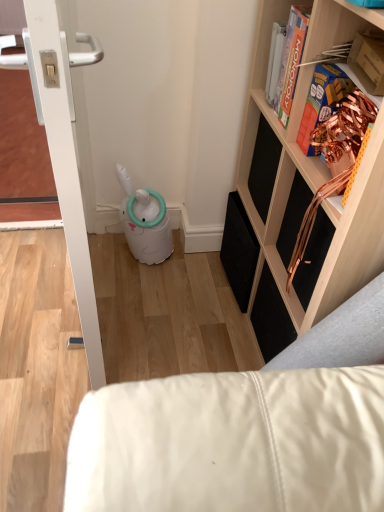
The image size is (384, 512). I want to click on white leather couch at lower right, so click(x=245, y=430).

Image resolution: width=384 pixels, height=512 pixels. What do you see at coordinates (322, 101) in the screenshot?
I see `copper foil book at upper right, arranged as the first book when ordered from the bottom` at bounding box center [322, 101].

Measure the distance between point (79,316) and camera.

1.14 meters.

Measure the distance between orange matte monopoly board game at upper right, which is the first book from top to bottom, and camera.

orange matte monopoly board game at upper right, which is the first book from top to bottom, is 35.55 inches from camera.

Locate an element on the screen. white leather couch at lower right is located at coordinates (245, 430).

From a real-world perspective, is orange matte monopoly board game at upper right, which appears as the 1th book when viewed from the back, positioned over copper foil book at upper right, the second book from the back, based on gravity?

Indeed, from a real-world perspective, orange matte monopoly board game at upper right, which appears as the 1th book when viewed from the back, stands above copper foil book at upper right, the second book from the back.

From the picture: From the image's perspective, is orange matte monopoly board game at upper right, which appears as the 1th book when viewed from the back, located above or below copper foil book at upper right, the second book from the back?

From the image's perspective, orange matte monopoly board game at upper right, which appears as the 1th book when viewed from the back, appears above copper foil book at upper right, the second book from the back.

Does orange matte monopoly board game at upper right, which is the second book from bottom to top, turn towards copper foil book at upper right, the second book from the back?

No, orange matte monopoly board game at upper right, which is the second book from bottom to top, is not aimed at copper foil book at upper right, the second book from the back.

Which of these two, orange matte monopoly board game at upper right, placed as the 2th book when sorted from front to back, or copper foil book at upper right, which is the 2th book in top-to-bottom order, is bigger?

With larger size is copper foil book at upper right, which is the 2th book in top-to-bottom order.

Is orange matte monopoly board game at upper right, which is the second book from bottom to top, situated inside wooden/black speaker at upper right or outside?

orange matte monopoly board game at upper right, which is the second book from bottom to top, is spatially positioned inside wooden/black speaker at upper right.

Where is `book that is the 2nd object to the left of the wooden/black speaker at upper right, starting at the anchor`? The width and height of the screenshot is (384, 512). book that is the 2nd object to the left of the wooden/black speaker at upper right, starting at the anchor is located at coordinates (291, 61).

Does point (294, 78) come behind point (258, 282)?

No, it is not.

Can you tell me how much wooden/black speaker at upper right and white glossy door at left differ in facing direction?

The angular difference between wooden/black speaker at upper right and white glossy door at left is 8.14 degrees.

Between wooden/black speaker at upper right and white glossy door at left, which one has more height?

wooden/black speaker at upper right.

Which is farther, (269, 5) or (42, 36)?

The point (269, 5) is more distant.

How far apart are wooden/black speaker at upper right and white glossy door at left?

wooden/black speaker at upper right is 57.78 centimeters away from white glossy door at left.

Is white glossy door at left wider than orange matte monopoly board game at upper right, which is the second book from bottom to top?

Correct, the width of white glossy door at left exceeds that of orange matte monopoly board game at upper right, which is the second book from bottom to top.

Can you confirm if white glossy door at left is bigger than orange matte monopoly board game at upper right, which appears as the 1th book when viewed from the back?

Correct, white glossy door at left is larger in size than orange matte monopoly board game at upper right, which appears as the 1th book when viewed from the back.

From the picture: Which is farther, (63,86) or (296,81)?

The point (296,81) is farther from the camera.

Is white glossy door at left completely or partially outside of orange matte monopoly board game at upper right, which is the first book from top to bottom?

That's correct, white glossy door at left is outside of orange matte monopoly board game at upper right, which is the first book from top to bottom.

How much distance is there between white glossy door at left and white leather couch at lower right?

They are 20.75 inches apart.

Are white glossy door at left and white leather couch at lower right far apart?

white glossy door at left is actually quite close to white leather couch at lower right.

Based on their sizes in the image, would you say white glossy door at left is bigger or smaller than white leather couch at lower right?

Considering their sizes, white glossy door at left takes up more space than white leather couch at lower right.

Relative to white leather couch at lower right, is white glossy door at left in front or behind?

Visually, white glossy door at left is located in front of white leather couch at lower right.

Consider the image. Could you tell me if white leather couch at lower right is turned towards orange matte monopoly board game at upper right, which is the second book from bottom to top?

No.

Is white leather couch at lower right not near orange matte monopoly board game at upper right, which appears as the 1th book when viewed from the back?

No, there isn't a large distance between white leather couch at lower right and orange matte monopoly board game at upper right, which appears as the 1th book when viewed from the back.

Is white leather couch at lower right taller than orange matte monopoly board game at upper right, which is the second book from bottom to top?

No, white leather couch at lower right is not taller than orange matte monopoly board game at upper right, which is the second book from bottom to top.

Is point (353, 447) closer or farther from the camera than point (287, 111)?

Clearly, point (353, 447) is closer to the camera than point (287, 111).

Between copper foil book at upper right, the second book from the back, and orange matte monopoly board game at upper right, which is the second book from bottom to top, which one has less height?

Standing shorter between the two is copper foil book at upper right, the second book from the back.

Are copper foil book at upper right, the second book from the back, and orange matte monopoly board game at upper right, which appears as the 1th book when viewed from the back, far apart?

Actually, copper foil book at upper right, the second book from the back, and orange matte monopoly board game at upper right, which appears as the 1th book when viewed from the back, are a little close together.

Can you confirm if copper foil book at upper right, the first book viewed from the front, is wider than orange matte monopoly board game at upper right, which appears as the 1th book when viewed from the back?

Yes.

Find the location of a particular element. The width and height of the screenshot is (384, 512). book below the orange matte monopoly board game at upper right, which is the second book from bottom to top (from a real-world perspective) is located at coordinates (322, 101).

I want to click on book that appears below the orange matte monopoly board game at upper right, which appears as the 1th book when viewed from the back (from a real-world perspective), so click(x=322, y=101).

Identify the location of shelf that appears below the orange matte monopoly board game at upper right, placed as the 2th book when sorted from front to back (from the image's perspective). The image size is (384, 512). (302, 212).

Estimate the real-world distances between objects in this image. Which object is closer to wooden/black speaker at upper right, orange matte monopoly board game at upper right, which is the second book from bottom to top, or white glossy door at left?

orange matte monopoly board game at upper right, which is the second book from bottom to top, is closer to wooden/black speaker at upper right.

From the image, which object appears to be nearer to copper foil book at upper right, which is the 2th book in top-to-bottom order, white glossy door at left or white leather couch at lower right?

Among the two, white glossy door at left is located nearer to copper foil book at upper right, which is the 2th book in top-to-bottom order.

Considering their positions, is white leather couch at lower right positioned further to wooden/black speaker at upper right than orange matte monopoly board game at upper right, which appears as the 1th book when viewed from the back?

white leather couch at lower right is further to wooden/black speaker at upper right.

When comparing their distances from wooden/black speaker at upper right, does white leather couch at lower right or white glossy door at left seem closer?

white leather couch at lower right.

Considering their positions, is wooden/black speaker at upper right positioned closer to white leather couch at lower right than white glossy door at left?

wooden/black speaker at upper right.

Considering their positions, is copper foil book at upper right, which is the 2th book in top-to-bottom order, positioned further to white glossy door at left than orange matte monopoly board game at upper right, which is the first book from top to bottom?

orange matte monopoly board game at upper right, which is the first book from top to bottom, lies further to white glossy door at left than the other object.

Considering their positions, is white leather couch at lower right positioned further to white glossy door at left than orange matte monopoly board game at upper right, which is the second book from bottom to top?

The object further to white glossy door at left is orange matte monopoly board game at upper right, which is the second book from bottom to top.

Which object lies nearer to the anchor point wooden/black speaker at upper right, copper foil book at upper right, arranged as the first book when ordered from the bottom, or orange matte monopoly board game at upper right, which appears as the 1th book when viewed from the back?

Among the two, orange matte monopoly board game at upper right, which appears as the 1th book when viewed from the back, is located nearer to wooden/black speaker at upper right.

Find the location of `book that lies between orange matte monopoly board game at upper right, which is the first book from top to bottom, and white leather couch at lower right from top to bottom`. book that lies between orange matte monopoly board game at upper right, which is the first book from top to bottom, and white leather couch at lower right from top to bottom is located at coordinates (322, 101).

Identify the location of door between orange matte monopoly board game at upper right, which is the second book from bottom to top, and white leather couch at lower right, in the vertical direction. 66,176.

Locate an element on the screen. book between wooden/black speaker at upper right and orange matte monopoly board game at upper right, placed as the 2th book when sorted from front to back, along the z-axis is located at coordinates (322, 101).

What are the coordinates of `furniture situated between white glossy door at left and wooden/black speaker at upper right from left to right` in the screenshot? It's located at (245, 430).